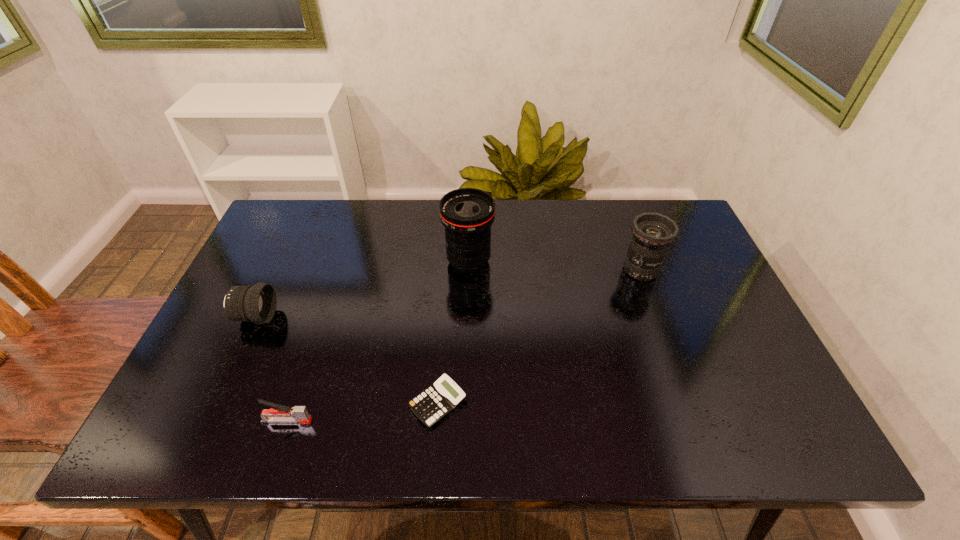
Locate an element on the screen. This screenshot has height=540, width=960. free spot located 0.320m on the front of the second tallest telephoto lens is located at coordinates [683, 384].

Locate an element on the screen. Image resolution: width=960 pixels, height=540 pixels. vacant region located at the front element of the nearest telephoto lens is located at coordinates (423, 317).

The height and width of the screenshot is (540, 960). In order to click on free space located 0.120m on the handle side of the stapler in this screenshot , I will do `click(367, 421)`.

This screenshot has height=540, width=960. Identify the location of vacant space located on the back of the calculator. (444, 327).

Identify the location of object at the far edge. The width and height of the screenshot is (960, 540). [467, 214].

Locate an element on the screen. The image size is (960, 540). stapler at the near edge is located at coordinates (279, 413).

What are the coordinates of `calculator that is at the near edge` in the screenshot? It's located at (438, 400).

I want to click on object that is positioned at the left edge, so click(257, 303).

Where is `object located at the right edge`? The height and width of the screenshot is (540, 960). object located at the right edge is located at coordinates (653, 233).

This screenshot has width=960, height=540. In the image, there is a desktop. Identify the location of vacant space at the far edge. (529, 200).